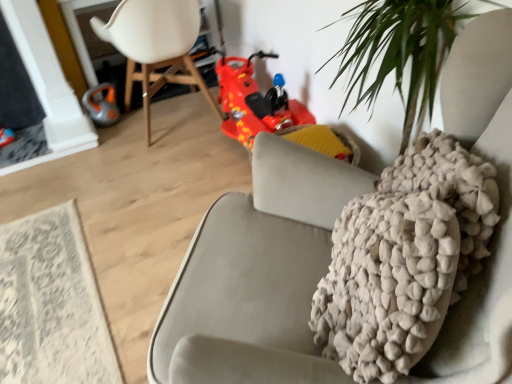
Where is `orange rubber vacuum cleaner at left`? The height and width of the screenshot is (384, 512). orange rubber vacuum cleaner at left is located at coordinates (102, 105).

Identify the location of shiny red plastic toy car at center. 254,101.

This screenshot has height=384, width=512. I want to click on white textured rug at lower left, so click(x=51, y=304).

Considering the sizes of objects shiny red plastic toy car at center and orange rubber vacuum cleaner at left in the image provided, who is smaller, shiny red plastic toy car at center or orange rubber vacuum cleaner at left?

orange rubber vacuum cleaner at left is smaller.

Consider the image. Which is further, (226, 97) or (113, 122)?

The point (113, 122) is farther from the camera.

Is shiny red plastic toy car at center inside the boundaries of orange rubber vacuum cleaner at left, or outside?

The correct answer is: outside.

Is shiny red plastic toy car at center positioned with its back to orange rubber vacuum cleaner at left?

No, shiny red plastic toy car at center is not facing away from orange rubber vacuum cleaner at left.

Which point is more forward, (114, 103) or (99, 29)?

The point (99, 29) is more forward.

In the scene shown: From a real-world perspective, who is located lower, orange rubber vacuum cleaner at left or white plastic chair at upper left?

From a 3D spatial view, orange rubber vacuum cleaner at left is below.

From the image's perspective, who appears lower, orange rubber vacuum cleaner at left or white plastic chair at upper left?

orange rubber vacuum cleaner at left.

Is white textured rug at lower left wider than white plastic chair at upper left?

No, white textured rug at lower left is not wider than white plastic chair at upper left.

Which is nearer, (16,226) or (137,7)?

The point (16,226) is closer.

Identify the location of mat that is below the orange rubber vacuum cleaner at left (from the image's perspective). The image size is (512, 384). pos(51,304).

Consider the image. Does white textured rug at lower left have a lesser height compared to orange rubber vacuum cleaner at left?

Yes, white textured rug at lower left is shorter than orange rubber vacuum cleaner at left.

Looking at their sizes, would you say white textured rug at lower left is wider or thinner than orange rubber vacuum cleaner at left?

Considering their sizes, white textured rug at lower left looks broader than orange rubber vacuum cleaner at left.

Considering the positions of objects white textured rug at lower left and orange rubber vacuum cleaner at left in the image provided, who is in front, white textured rug at lower left or orange rubber vacuum cleaner at left?

white textured rug at lower left is in front.

Who is bigger, orange rubber vacuum cleaner at left or white textured rug at lower left?

white textured rug at lower left is bigger.

From a real-world perspective, does orange rubber vacuum cleaner at left sit lower than white textured rug at lower left?

Actually, orange rubber vacuum cleaner at left is physically above white textured rug at lower left in the real world.

Measure the distance between orange rubber vacuum cleaner at left and white textured rug at lower left.

A distance of 1.22 meters exists between orange rubber vacuum cleaner at left and white textured rug at lower left.

Based on the photo, from the image's perspective, between orange rubber vacuum cleaner at left and white textured rug at lower left, which one is located above?

orange rubber vacuum cleaner at left is shown above in the image.

Consider the image. Is shiny red plastic toy car at center positioned with its back to white plastic chair at upper left?

No, white plastic chair at upper left is not at the back of shiny red plastic toy car at center.

Based on the photo, which object is wider, shiny red plastic toy car at center or white plastic chair at upper left?

With larger width is white plastic chair at upper left.

From a real-world perspective, which is physically above, shiny red plastic toy car at center or white plastic chair at upper left?

white plastic chair at upper left.

Looking at this image, how many degrees apart are the facing directions of shiny red plastic toy car at center and white plastic chair at upper left?

The angular difference between shiny red plastic toy car at center and white plastic chair at upper left is 90 degrees.

Looking at this image, does white textured rug at lower left have a greater width compared to shiny red plastic toy car at center?

Yes.

Considering the positions of points (52, 341) and (223, 108), is point (52, 341) closer to camera compared to point (223, 108)?

Yes, it is in front of point (223, 108).

From the image's perspective, is white textured rug at lower left above or below shiny red plastic toy car at center?

From the image's perspective, white textured rug at lower left appears below shiny red plastic toy car at center.

The height and width of the screenshot is (384, 512). Find the location of `mat on the left of the shiny red plastic toy car at center`. mat on the left of the shiny red plastic toy car at center is located at coordinates (51, 304).

Identify the location of toy on the left of shiny red plastic toy car at center. The width and height of the screenshot is (512, 384). (102, 105).

Locate an element on the screen. toy located behind the white plastic chair at upper left is located at coordinates (102, 105).

Which object lies nearer to the anchor point orange rubber vacuum cleaner at left, shiny red plastic toy car at center or white textured rug at lower left?

shiny red plastic toy car at center is closer to orange rubber vacuum cleaner at left.

From the image, which object appears to be farther from orange rubber vacuum cleaner at left, white plastic chair at upper left or white textured rug at lower left?

Based on the image, white textured rug at lower left appears to be further to orange rubber vacuum cleaner at left.

Which object lies nearer to the anchor point shiny red plastic toy car at center, orange rubber vacuum cleaner at left or white plastic chair at upper left?

white plastic chair at upper left is positioned closer to the anchor shiny red plastic toy car at center.

Based on their spatial positions, is white textured rug at lower left or white plastic chair at upper left further from shiny red plastic toy car at center?

white textured rug at lower left.

In the scene shown: Estimate the real-world distances between objects in this image. Which object is further from white plastic chair at upper left, white textured rug at lower left or shiny red plastic toy car at center?

white textured rug at lower left is positioned further to the anchor white plastic chair at upper left.

When comparing their distances from white textured rug at lower left, does shiny red plastic toy car at center or white plastic chair at upper left seem closer?

Based on the image, white plastic chair at upper left appears to be nearer to white textured rug at lower left.

From the image, which object appears to be farther from white textured rug at lower left, white plastic chair at upper left or orange rubber vacuum cleaner at left?

orange rubber vacuum cleaner at left is further to white textured rug at lower left.

Estimate the real-world distances between objects in this image. Which object is closer to orange rubber vacuum cleaner at left, white plastic chair at upper left or shiny red plastic toy car at center?

white plastic chair at upper left is closer to orange rubber vacuum cleaner at left.

At what (x,y) coordinates should I click in order to perform the action: click on toy car between white textured rug at lower left and orange rubber vacuum cleaner at left along the z-axis. Please return your answer as a coordinate pair (x, y). Looking at the image, I should click on (254, 101).

This screenshot has height=384, width=512. I want to click on toy car between white plastic chair at upper left and white textured rug at lower left vertically, so click(x=254, y=101).

At what (x,y) coordinates should I click in order to perform the action: click on chair between orange rubber vacuum cleaner at left and shiny red plastic toy car at center. Please return your answer as a coordinate pair (x, y). The height and width of the screenshot is (384, 512). Looking at the image, I should click on (155, 46).

You are a GUI agent. You are given a task and a screenshot of the screen. Output one action in this format:
    pyautogui.click(x=<x>, y=<y>)
    Task: Click on the toy between white plastic chair at upper left and white textured rug at lower left from top to bottom
    
    Given the screenshot: What is the action you would take?
    pyautogui.click(x=102, y=105)